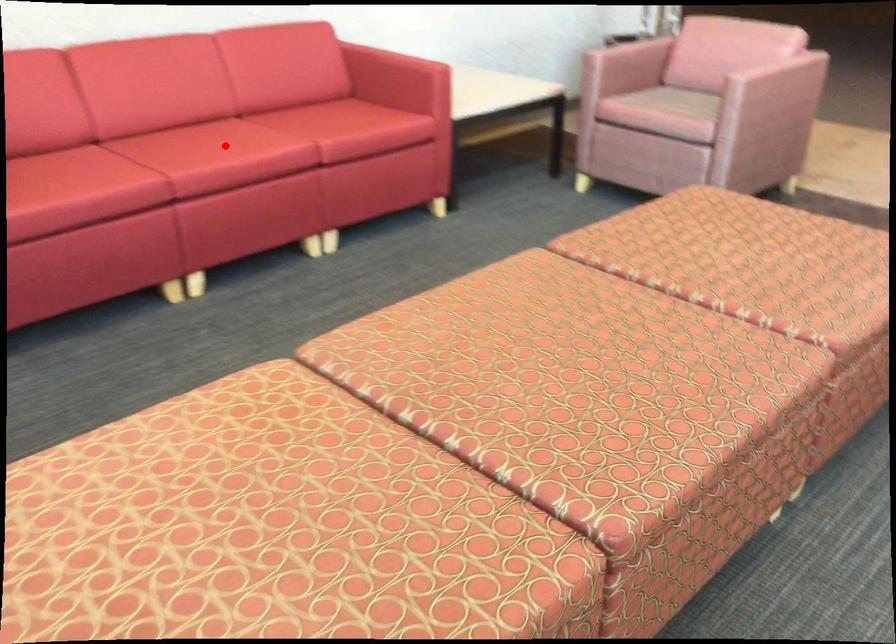
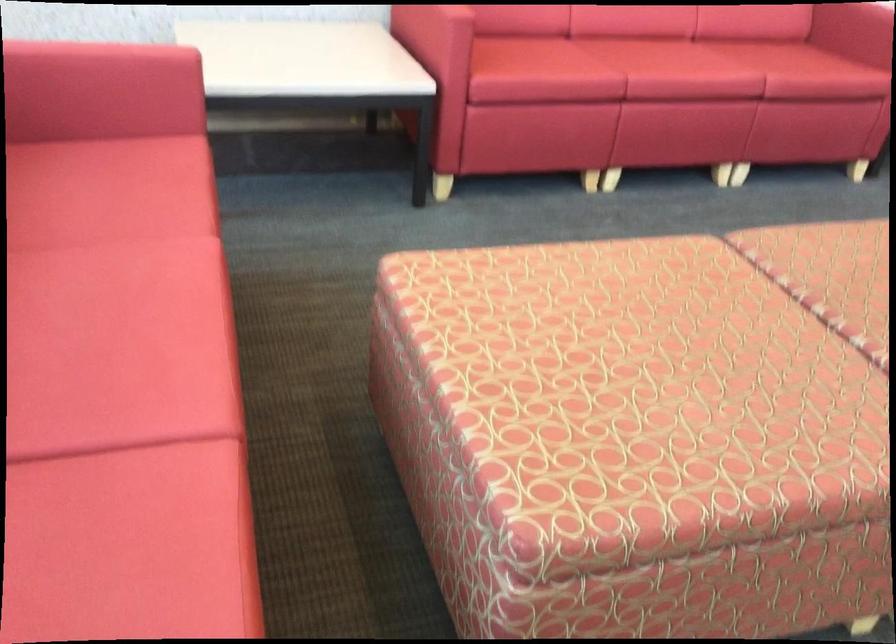
The point at the highlighted location is marked in the first image. Where is the corresponding point in the second image?

(677, 62)